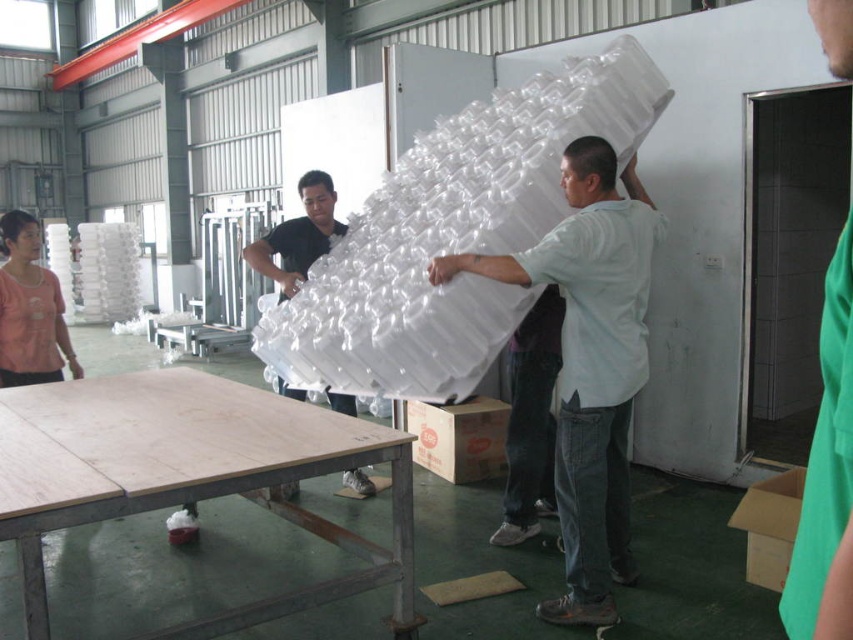
Between white matte foam at center and brown cardboard box at lower right, which one has more height?

white matte foam at center is taller.

From the picture: Does white matte foam at center have a smaller size compared to brown cardboard box at lower right?

Actually, white matte foam at center might be larger than brown cardboard box at lower right.

Locate an element on the screen. The height and width of the screenshot is (640, 853). white matte foam at center is located at coordinates (299, 236).

Locate an element on the screen. white matte foam at center is located at coordinates (299, 236).

Is brown cardboard box at center positioned behind brown cardboard box at lower right?

Yes, brown cardboard box at center is behind brown cardboard box at lower right.

This screenshot has height=640, width=853. In order to click on brown cardboard box at center in this screenshot , I will do (459, 436).

Identify the location of brown cardboard box at center. (459, 436).

The width and height of the screenshot is (853, 640). What are the coordinates of `brown cardboard box at center` in the screenshot? It's located at (459, 436).

Which of these two, white matte bubble wrap at center or white matte foam at center, stands shorter?

white matte foam at center is shorter.

Which is more to the right, white matte bubble wrap at center or white matte foam at center?

From the viewer's perspective, white matte bubble wrap at center appears more on the right side.

Is point (589, 419) farther from camera compared to point (302, 198)?

No, it is in front of (302, 198).

The width and height of the screenshot is (853, 640). In order to click on white matte bubble wrap at center in this screenshot , I will do `click(589, 365)`.